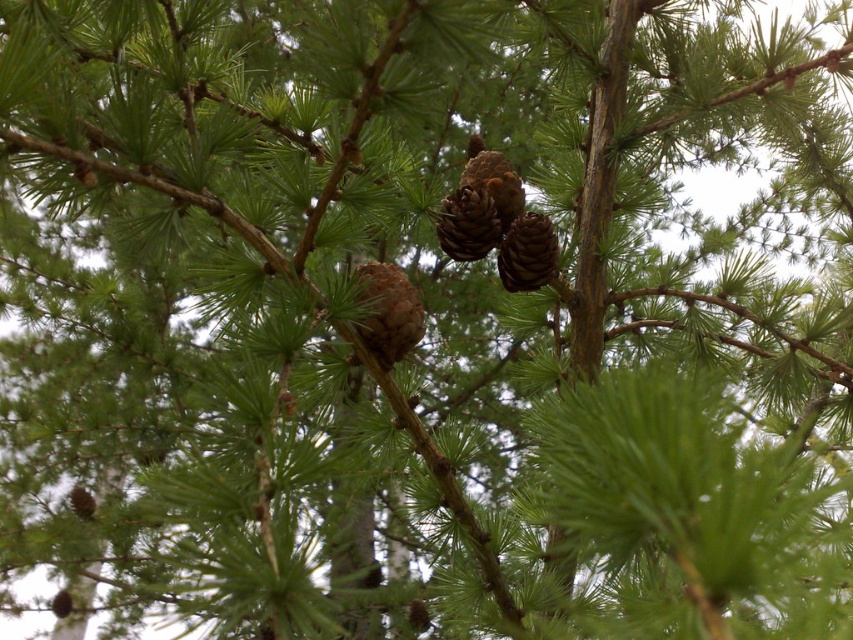
Question: Among these objects, which one is nearest to the camera?

Choices:
 (A) brown rough pine cone at center
 (B) brown matte pine cone at center

Answer: (B)

Question: Is brown matte pine cone at center to the right of brown rough pine cone at center from the viewer's perspective?

Choices:
 (A) no
 (B) yes

Answer: (A)

Question: Can you confirm if brown matte pine cone at center is positioned above brown rough pine cone at center?

Choices:
 (A) no
 (B) yes

Answer: (A)

Question: Among these points, which one is nearest to the camera?

Choices:
 (A) (386, 340)
 (B) (553, 232)

Answer: (A)

Question: Does brown matte pine cone at center appear on the right side of brown rough pine cone at center?

Choices:
 (A) yes
 (B) no

Answer: (B)

Question: Among these objects, which one is nearest to the camera?

Choices:
 (A) brown matte pine cone at center
 (B) brown rough pine cone at center

Answer: (A)